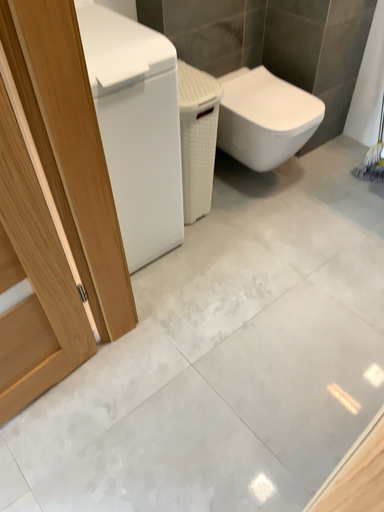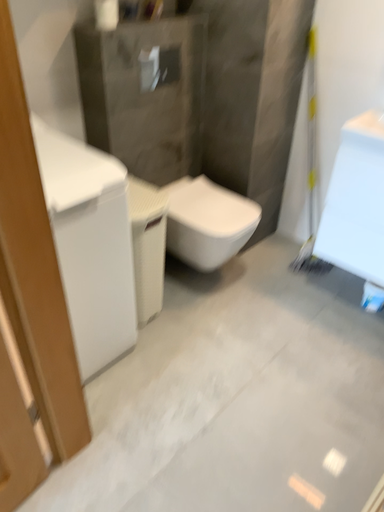
Question: Which way did the camera rotate in the video?

Choices:
 (A) rotated downward
 (B) rotated upward

Answer: (B)